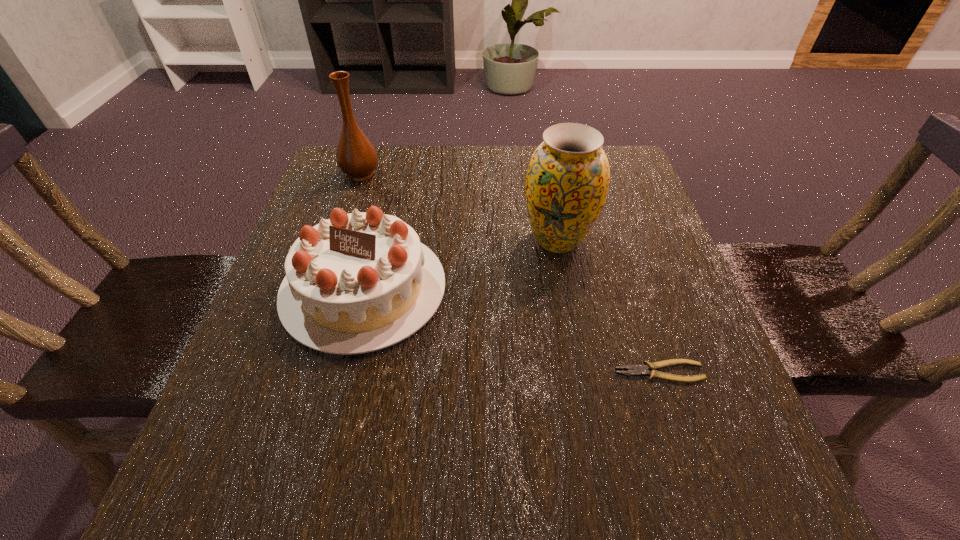
Where is `object that is at the far edge`? This screenshot has width=960, height=540. object that is at the far edge is located at coordinates (356, 157).

This screenshot has width=960, height=540. I want to click on vase situated at the left edge, so click(356, 157).

This screenshot has width=960, height=540. In order to click on birthday cake positioned at the left edge in this screenshot , I will do `click(360, 282)`.

Image resolution: width=960 pixels, height=540 pixels. In order to click on vase that is at the right edge in this screenshot , I will do `click(567, 181)`.

Where is `pliers situated at the right edge`? pliers situated at the right edge is located at coordinates (636, 370).

The height and width of the screenshot is (540, 960). Find the location of `object present at the far left corner`. object present at the far left corner is located at coordinates tap(356, 157).

The width and height of the screenshot is (960, 540). I want to click on vacant space at the far edge of the desktop, so click(x=452, y=163).

Where is `vacant point at the near edge`? The image size is (960, 540). vacant point at the near edge is located at coordinates (569, 514).

Where is `vacant space at the left edge of the desktop`? The image size is (960, 540). vacant space at the left edge of the desktop is located at coordinates (247, 369).

Locate an element on the screen. This screenshot has width=960, height=540. free point at the right edge is located at coordinates (625, 230).